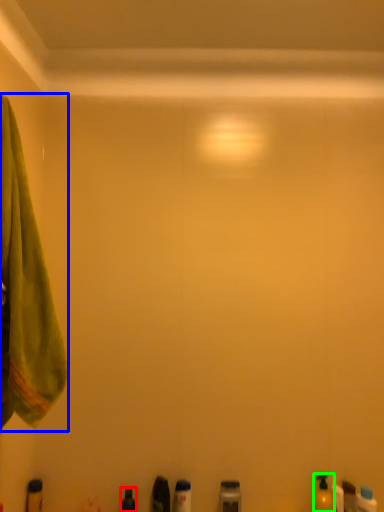
Question: Based on their relative distances, which object is nearer to toiletry (highlighted by a red box)? Choose from towel (highlighted by a blue box) and toiletry (highlighted by a green box).

Choices:
 (A) towel
 (B) toiletry

Answer: (B)